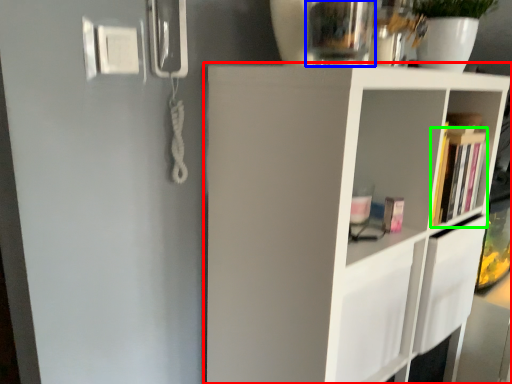
Question: Based on their relative distances, which object is nearer to shelf (highlighted by a red box)? Choose from glass vase (highlighted by a blue box) and book (highlighted by a green box).

Choices:
 (A) glass vase
 (B) book

Answer: (B)